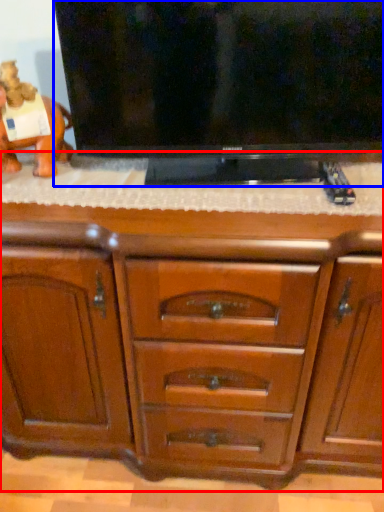
Question: Which object is closer to the camera taking this photo, chest of drawers (highlighted by a red box) or television (highlighted by a blue box)?

Choices:
 (A) chest of drawers
 (B) television

Answer: (A)